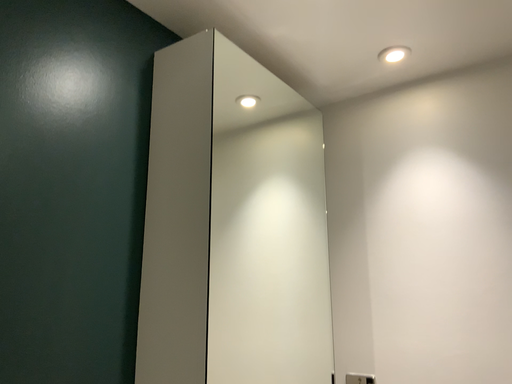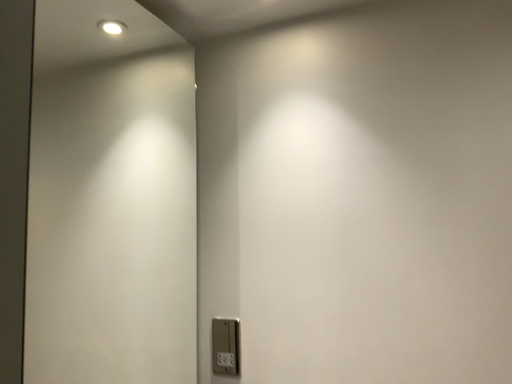
Question: Which way did the camera rotate in the video?

Choices:
 (A) rotated downward
 (B) rotated upward

Answer: (A)